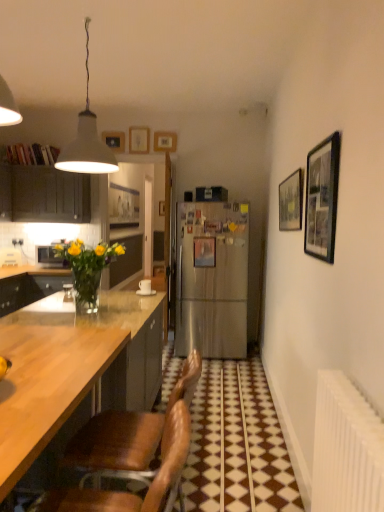
Question: Is matte dark wood cabinet at left smaller than white matte lampshade at upper center?

Choices:
 (A) no
 (B) yes

Answer: (A)

Question: Can you confirm if matte dark wood cabinet at left is bigger than white matte lampshade at upper center?

Choices:
 (A) yes
 (B) no

Answer: (A)

Question: Can you confirm if matte dark wood cabinet at left is positioned to the right of white matte lampshade at upper center?

Choices:
 (A) yes
 (B) no

Answer: (B)

Question: Is white matte lampshade at upper center a part of matte dark wood cabinet at left?

Choices:
 (A) yes
 (B) no

Answer: (B)

Question: Is the position of matte dark wood cabinet at left less distant than that of white matte lampshade at upper center?

Choices:
 (A) yes
 (B) no

Answer: (B)

Question: From a real-world perspective, is matte dark wood cabinet at left on white matte lampshade at upper center?

Choices:
 (A) yes
 (B) no

Answer: (B)

Question: Does black matte picture frame at upper right, marked as the 2th picture frame in a right-to-left arrangement, have a larger size compared to matte wooden picture frame at upper center, acting as the sixth picture frame starting from the right?

Choices:
 (A) no
 (B) yes

Answer: (A)

Question: Can you confirm if black matte picture frame at upper right, which appears as the fifth picture frame when viewed from the left, is smaller than matte wooden picture frame at upper center, the 6th picture frame positioned from the front?

Choices:
 (A) no
 (B) yes

Answer: (B)

Question: Would you say black matte picture frame at upper right, the 1th picture frame viewed from the front, is outside matte wooden picture frame at upper center, which is the 1th picture frame from back to front?

Choices:
 (A) no
 (B) yes

Answer: (B)

Question: Is black matte picture frame at upper right, marked as the 2th picture frame in a right-to-left arrangement, not close to matte wooden picture frame at upper center, which is the 1th picture frame from back to front?

Choices:
 (A) no
 (B) yes

Answer: (B)

Question: From a real-world perspective, does black matte picture frame at upper right, the 1th picture frame viewed from the front, sit lower than matte wooden picture frame at upper center, which is the 1th picture frame from back to front?

Choices:
 (A) yes
 (B) no

Answer: (A)

Question: Is the position of black matte picture frame at upper right, the 1th picture frame viewed from the front, more distant than that of matte wooden picture frame at upper center, acting as the sixth picture frame starting from the right?

Choices:
 (A) yes
 (B) no

Answer: (B)

Question: Is the position of matte dark wood cabinet at left more distant than that of black matte picture frame at upper right, placed as the 6th picture frame when sorted from back to front?

Choices:
 (A) no
 (B) yes

Answer: (B)